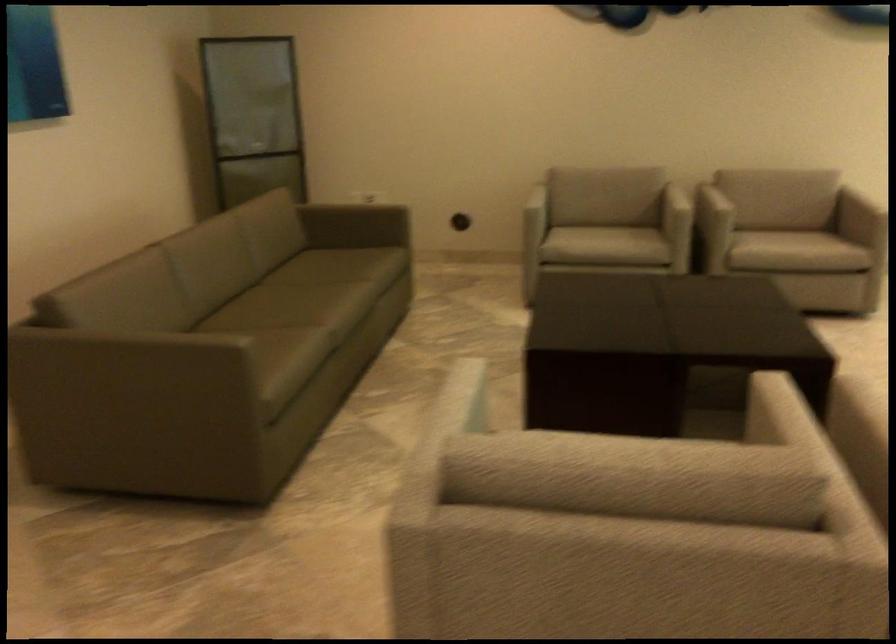
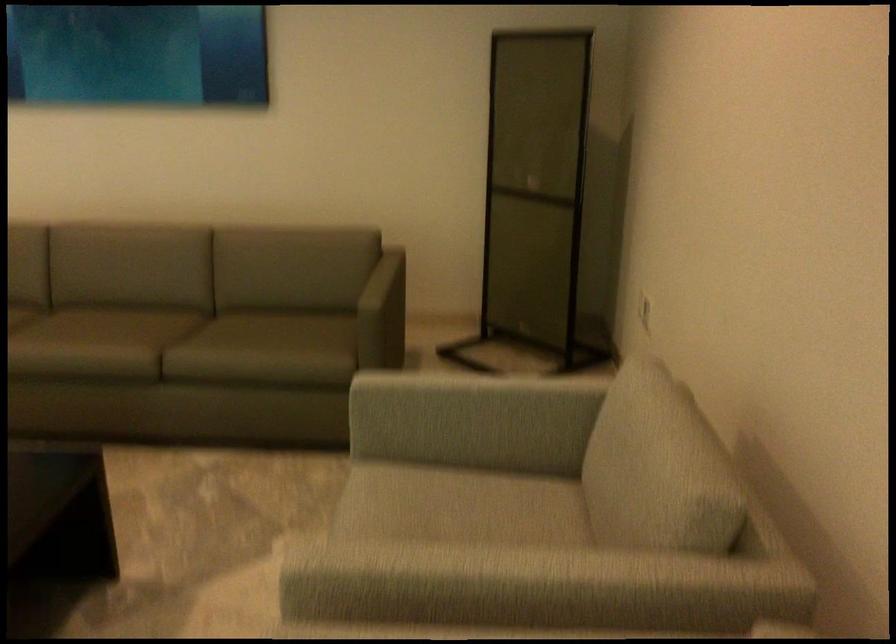
Find the pixel in the second image that matches point 297,283 in the first image.

(128, 327)